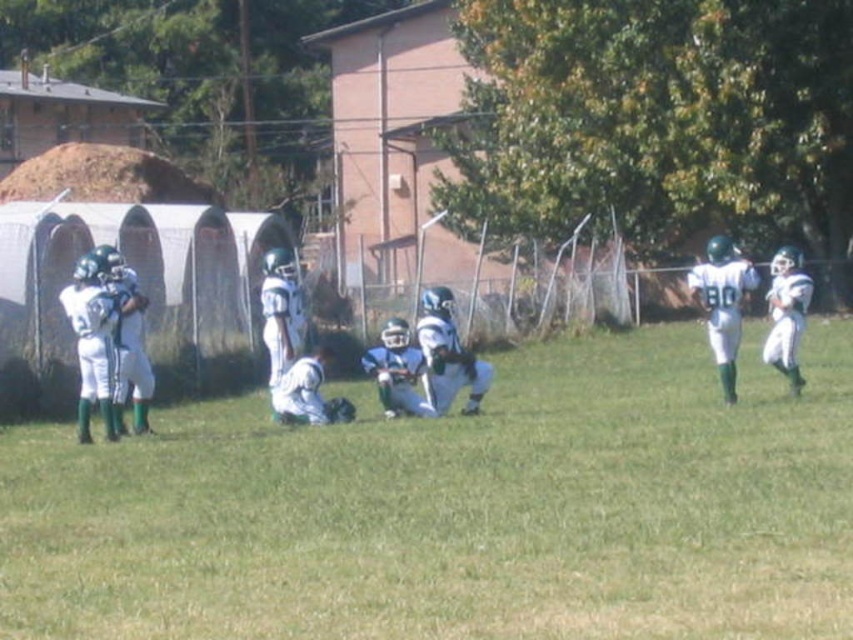
Measure the distance between white uniformed players at center and camera.

A distance of 23.24 feet exists between white uniformed players at center and camera.

Does white uniformed players at center have a lesser height compared to white matte football player at right?

Correct, white uniformed players at center is not as tall as white matte football player at right.

This screenshot has width=853, height=640. Find the location of `white uniformed players at center`. white uniformed players at center is located at coordinates (456, 509).

Between point (379, 355) and point (738, 344), which one is positioned behind?

The point (738, 344) is behind.

Where is `white matte football players at left`? Image resolution: width=853 pixels, height=640 pixels. white matte football players at left is located at coordinates (384, 369).

I want to click on white matte football players at left, so click(x=384, y=369).

Is point (728, 294) closer to camera compared to point (779, 371)?

Yes, it is.

At what (x,y) coordinates should I click in order to perform the action: click on white matte football player at right. Please return your answer as a coordinate pair (x, y). The image size is (853, 640). Looking at the image, I should click on (722, 304).

Identify the location of white matte football player at right. (722, 304).